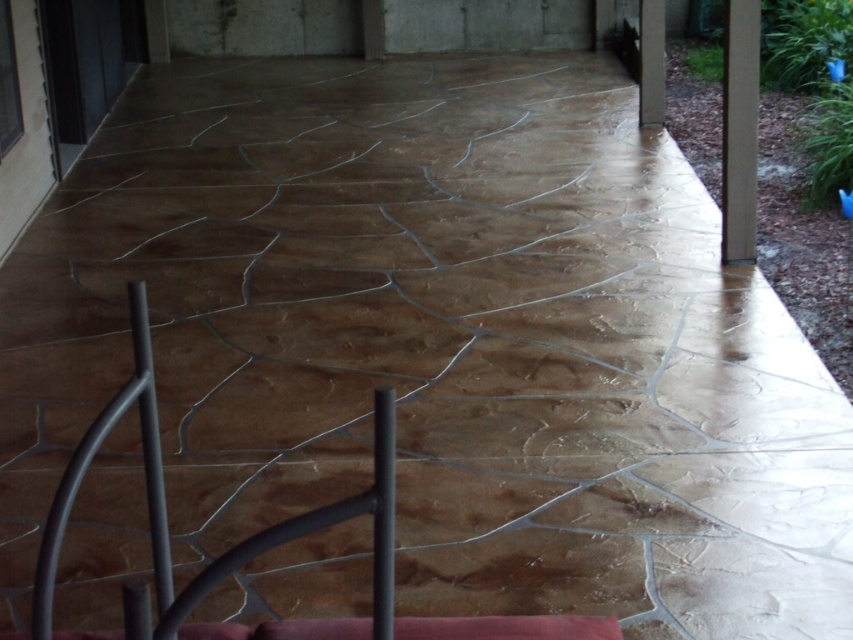
Does brown wood pillar at upper right have a larger size compared to smooth concrete pillar at upper right?

Correct, brown wood pillar at upper right is larger in size than smooth concrete pillar at upper right.

Is point (750, 246) positioned after point (654, 52)?

No, it is in front of (654, 52).

Does point (728, 1) come closer to viewer compared to point (643, 102)?

Yes.

Image resolution: width=853 pixels, height=640 pixels. I want to click on brown wood pillar at upper right, so click(740, 131).